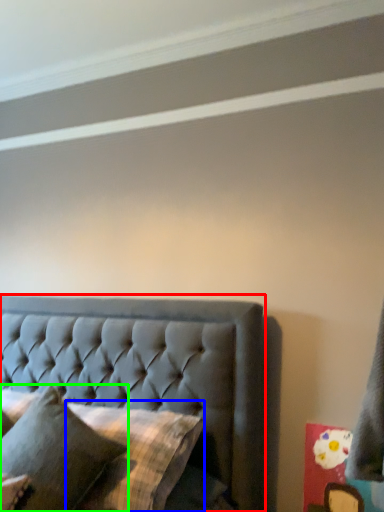
Question: Considering the real-world distances, which object is farthest from bed (highlighted by a red box)? pillow (highlighted by a blue box) or pillow (highlighted by a green box)?

Choices:
 (A) pillow
 (B) pillow

Answer: (B)